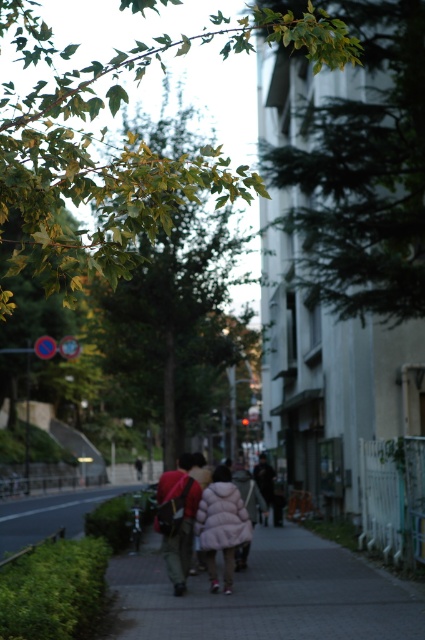
Question: Does paved sidewalk at center appear on the right side of fluffy pink jacket at center?

Choices:
 (A) no
 (B) yes

Answer: (B)

Question: Estimate the real-world distances between objects in this image. Which object is farther from the khaki canvas backpack at center?

Choices:
 (A) fluffy pink coat at center
 (B) green leafy tree at upper left
 (C) green leafy tree at upper center
 (D) paved sidewalk at center

Answer: (B)

Question: Can you confirm if khaki canvas backpack at center is thinner than fluffy pink jacket at center?

Choices:
 (A) no
 (B) yes

Answer: (B)

Question: Which point appears farthest from the camera in this image?

Choices:
 (A) (175, 412)
 (B) (365, 310)

Answer: (A)

Question: Which point is closer to the camera taking this photo?

Choices:
 (A) pos(186,340)
 (B) pos(2,538)
 (C) pos(362,8)

Answer: (C)

Question: Where is green leafy tree at upper left located in relation to paved sidewalk at center in the image?

Choices:
 (A) below
 (B) above

Answer: (B)